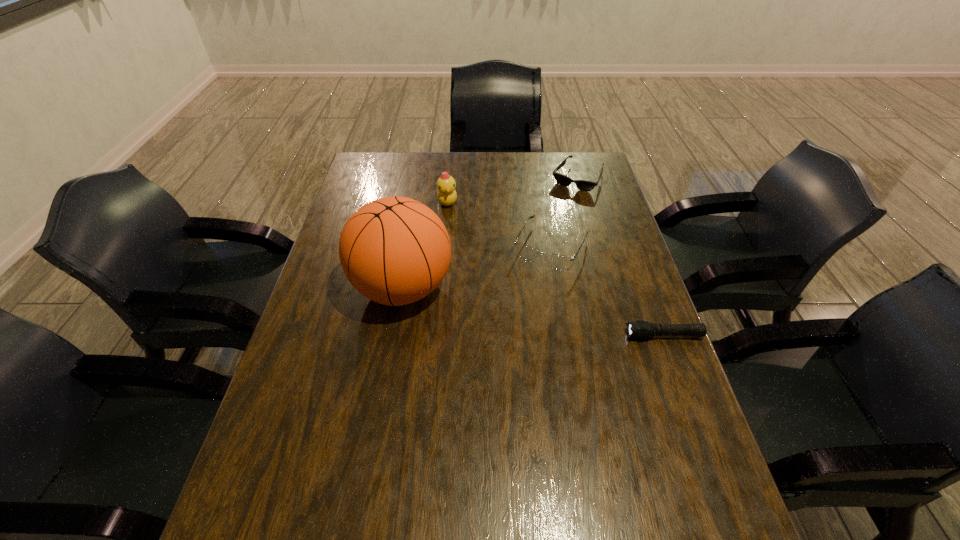
Identify the location of free spot on the desktop that is between the basketball and the flashlight and is positioned on the front-facing side of the spectacles. The height and width of the screenshot is (540, 960). (517, 308).

Find the location of a particular element. The image size is (960, 540). free space on the desktop that is between the basketball and the flashlight and is positioned on the front-facing side of the fourth shortest object is located at coordinates (563, 317).

The height and width of the screenshot is (540, 960). In order to click on free spot on the desktop that is between the tallest object and the nearest object and is positioned on the front-facing side of the sunglasses in this screenshot , I will do click(498, 305).